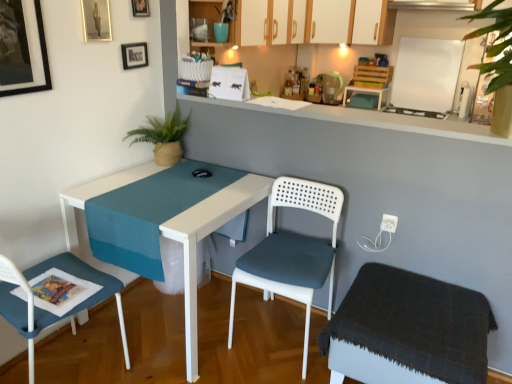
Question: Is teal fabric at upper center further to camera compared to matte white cabinet at upper center, which is counted as the 3th cabinetry, starting from the back?

Choices:
 (A) no
 (B) yes

Answer: (B)

Question: Is teal fabric at upper center not close to matte white cabinet at upper center, marked as the first cabinetry in a left-to-right arrangement?

Choices:
 (A) no
 (B) yes

Answer: (A)

Question: Does teal fabric at upper center have a greater width compared to matte white cabinet at upper center, marked as the 3th cabinetry in a right-to-left arrangement?

Choices:
 (A) no
 (B) yes

Answer: (A)

Question: Could you tell me if teal fabric at upper center is turned towards matte white cabinet at upper center, which is counted as the 3th cabinetry, starting from the back?

Choices:
 (A) no
 (B) yes

Answer: (B)

Question: Is teal fabric at upper center shorter than matte white cabinet at upper center, marked as the 3th cabinetry in a right-to-left arrangement?

Choices:
 (A) no
 (B) yes

Answer: (B)

Question: Is teal fabric at upper center not inside matte white cabinet at upper center, marked as the first cabinetry in a left-to-right arrangement?

Choices:
 (A) yes
 (B) no

Answer: (B)

Question: Can you confirm if white matte board at upper right is shorter than teal fabric at upper center?

Choices:
 (A) no
 (B) yes

Answer: (A)

Question: Is white matte board at upper right directly adjacent to teal fabric at upper center?

Choices:
 (A) yes
 (B) no

Answer: (B)

Question: Is white matte board at upper right positioned with its back to teal fabric at upper center?

Choices:
 (A) no
 (B) yes

Answer: (A)

Question: Is white matte board at upper right aimed at teal fabric at upper center?

Choices:
 (A) yes
 (B) no

Answer: (B)

Question: From the image's perspective, is white matte board at upper right over teal fabric at upper center?

Choices:
 (A) yes
 (B) no

Answer: (A)

Question: Does white matte board at upper right have a lesser width compared to teal fabric at upper center?

Choices:
 (A) yes
 (B) no

Answer: (A)

Question: Could you tell me if matte black picture frame at upper left, acting as the 1th picture frame starting from the front, is turned towards dark gray fabric stool at lower right?

Choices:
 (A) yes
 (B) no

Answer: (B)